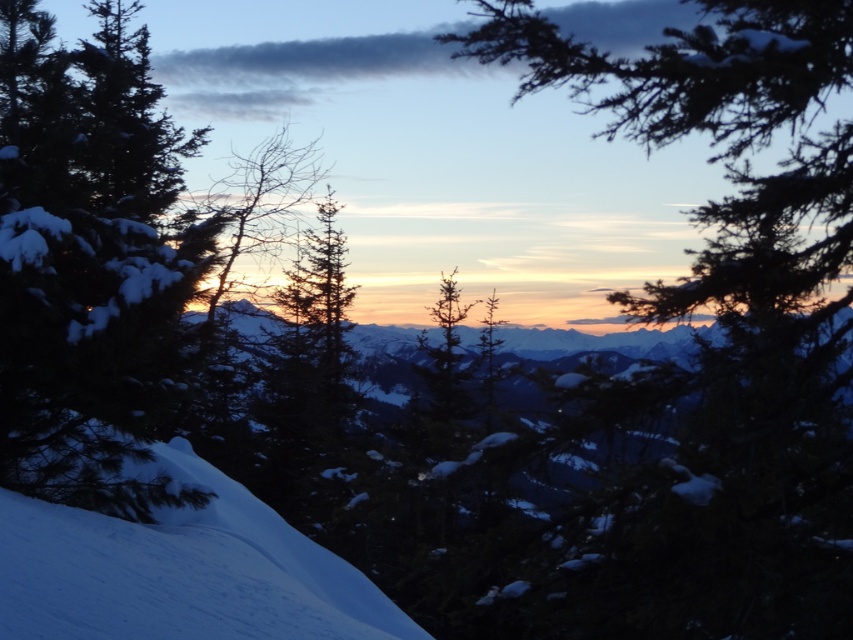
Can you confirm if green matte tree at upper right is positioned to the right of white snow at lower left?

Indeed, green matte tree at upper right is positioned on the right side of white snow at lower left.

Looking at this image, is green matte tree at upper right taller than white snow at lower left?

Indeed, green matte tree at upper right has a greater height compared to white snow at lower left.

Describe the element at coordinates (723, 336) in the screenshot. I see `green matte tree at upper right` at that location.

Locate an element on the screen. green matte tree at upper right is located at coordinates (723, 336).

Is snow-covered evergreen at left wider than white snow at lower left?

Correct, the width of snow-covered evergreen at left exceeds that of white snow at lower left.

Is snow-covered evergreen at left shorter than white snow at lower left?

Incorrect, snow-covered evergreen at left's height does not fall short of white snow at lower left's.

Does point (177, 129) lie behind point (368, 586)?

Yes.

In order to click on snow-covered evergreen at left in this screenshot , I will do `click(90, 260)`.

Is green matte tree at upper right smaller than snow-covered evergreen at left?

Yes, green matte tree at upper right is smaller than snow-covered evergreen at left.

Does green matte tree at upper right have a lesser width compared to snow-covered evergreen at left?

Yes.

What do you see at coordinates (723, 336) in the screenshot?
I see `green matte tree at upper right` at bounding box center [723, 336].

Image resolution: width=853 pixels, height=640 pixels. What are the coordinates of `green matte tree at upper right` in the screenshot? It's located at (723, 336).